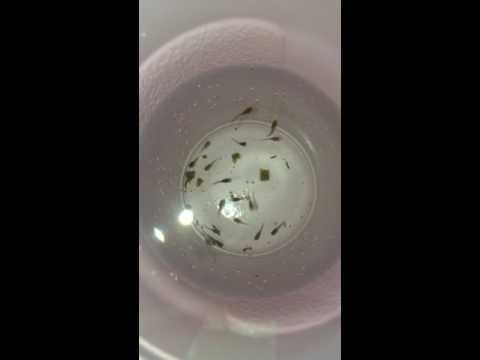
Identify the location of edge of bowl. The height and width of the screenshot is (360, 480). (151, 92), (209, 53), (306, 60), (317, 345), (240, 344), (169, 324).